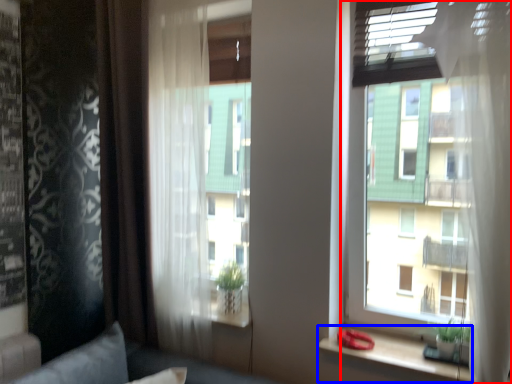
Question: Which object appears closest to the camera in this image, window (highlighted by a red box) or window sill (highlighted by a blue box)?

Choices:
 (A) window
 (B) window sill

Answer: (A)